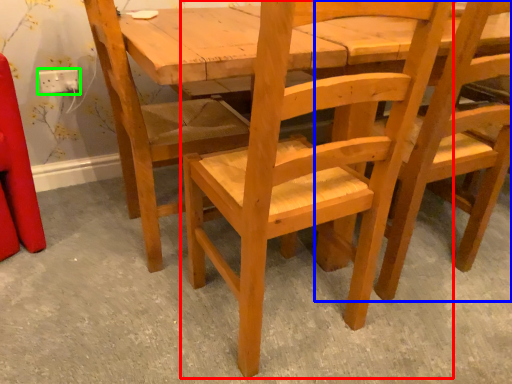
Question: Which object is positioned closest to chair (highlighted by a red box)? Select from chair (highlighted by a blue box) and electric outlet (highlighted by a green box).

Choices:
 (A) chair
 (B) electric outlet

Answer: (A)